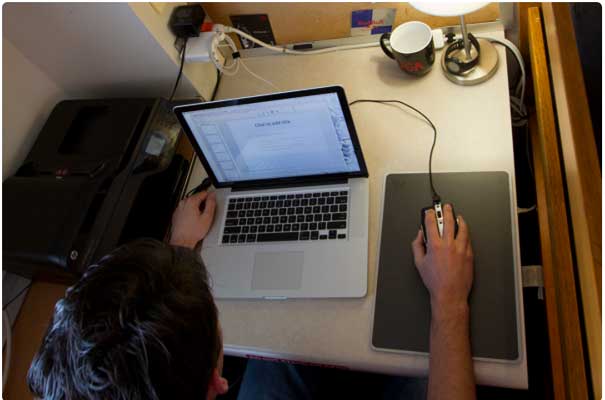
You are a GUI agent. You are given a task and a screenshot of the screen. Output one action in this format:
    pyautogui.click(x=<x>, y=<y>)
    Task: Click on the labtop screen
    The width and height of the screenshot is (605, 400).
    Given the screenshot: What is the action you would take?
    pyautogui.click(x=282, y=141)